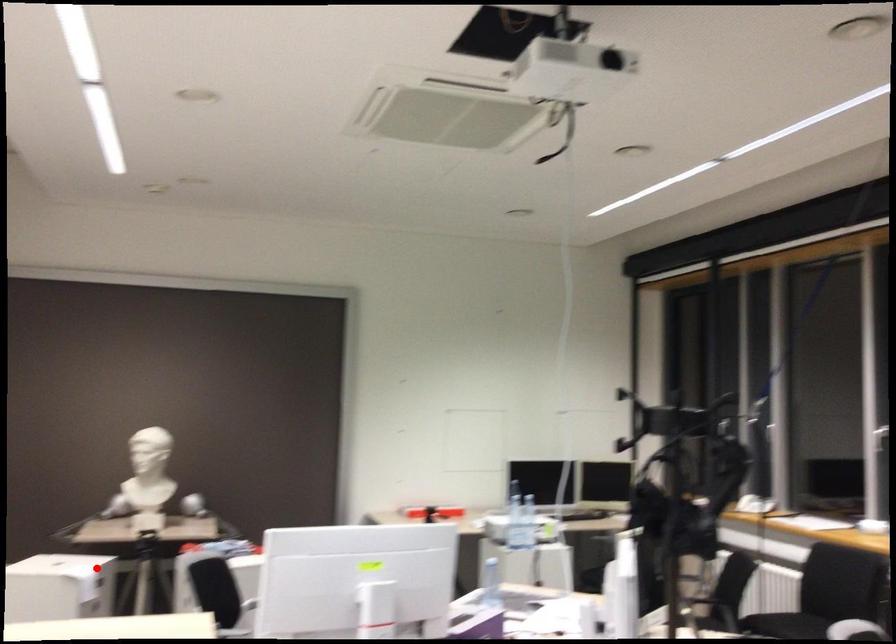
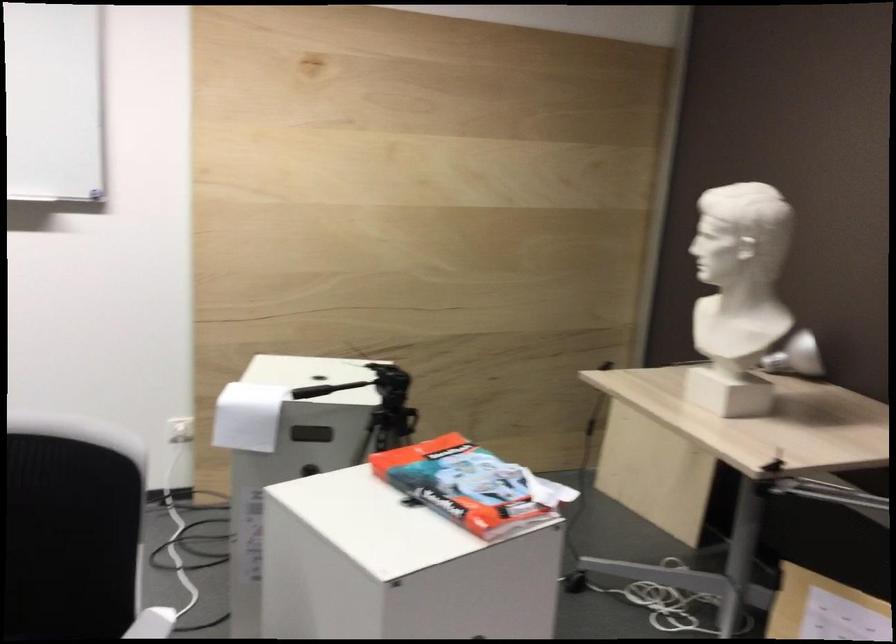
Find the pixel in the second image that matches the highlighted location in the first image.

(247, 415)